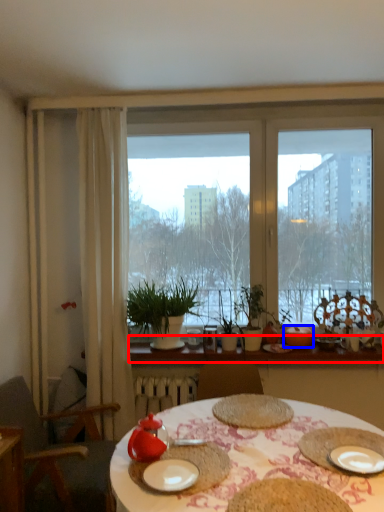
Question: Among these objects, which one is nearest to the camera, window sill (highlighted by a red box) or tableware (highlighted by a blue box)?

Choices:
 (A) window sill
 (B) tableware

Answer: (A)